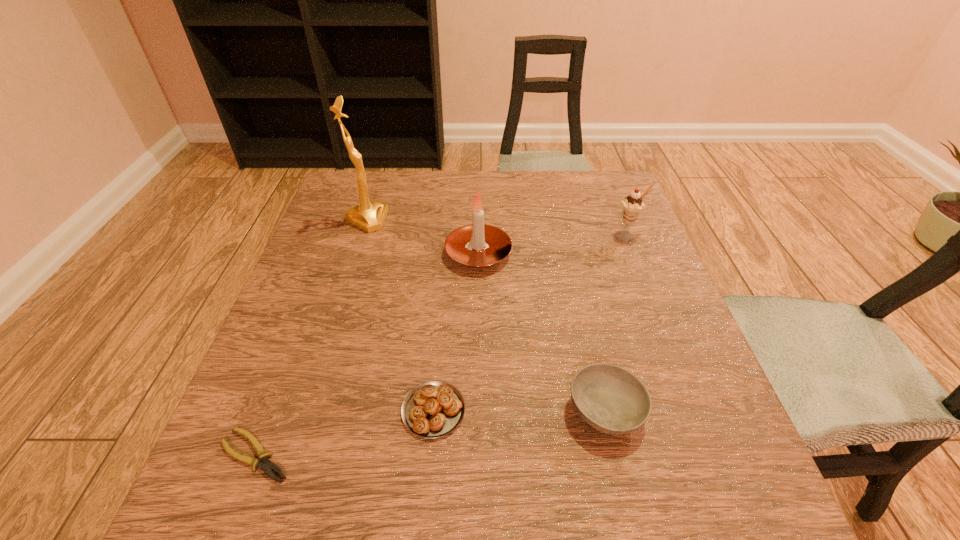
The image size is (960, 540). I want to click on object that is at the near left corner, so click(267, 466).

In the image, there is a desktop. Where is `vacant space at the far edge`? vacant space at the far edge is located at coordinates (547, 184).

Locate an element on the screen. The width and height of the screenshot is (960, 540). vacant space at the near edge is located at coordinates (357, 483).

In the image, there is a desktop. Where is `vacant region at the left edge`? This screenshot has width=960, height=540. vacant region at the left edge is located at coordinates (342, 281).

Identify the location of vacant space at the right edge. 717,429.

Identify the location of vacant region at the far left corner of the desktop. The image size is (960, 540). (380, 172).

In the image, there is a desktop. What are the coordinates of `vacant space at the near left corner` in the screenshot? It's located at pos(296,526).

Where is `vacant space at the far right corner of the desktop`? vacant space at the far right corner of the desktop is located at coordinates (565, 181).

Find the location of a particular element. The height and width of the screenshot is (540, 960). vacant space that is in between the pliers and the tallest object is located at coordinates (311, 338).

This screenshot has width=960, height=540. I want to click on vacant space in between the icecream and the award, so click(497, 228).